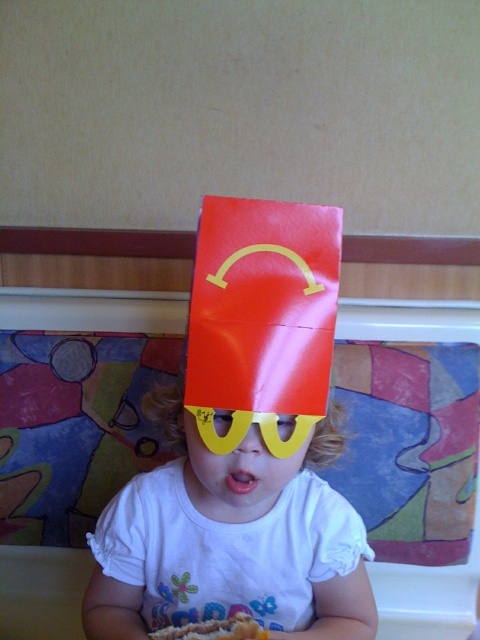
You are a photographer setting up for a family photo. The child is wearing a white matte shirt at center and has yellow plastic glasses at center on their head. To ensure the shirt and glasses are both clearly visible, which item should you position closer to the camera?

The white matte shirt at center should be positioned closer to the camera because it might be wider than the yellow plastic glasses at center, ensuring both are clearly visible.

You are a photographer taking a picture of the yellow plastic glasses at center and the golden crispy french fries at lower center. Which object should you focus on first to ensure both are in frame without moving the camera?

You should focus on the yellow plastic glasses at center first because it is closer to the viewer than the golden crispy french fries at lower center, so adjusting focus starting from the closer object ensures both are in frame.